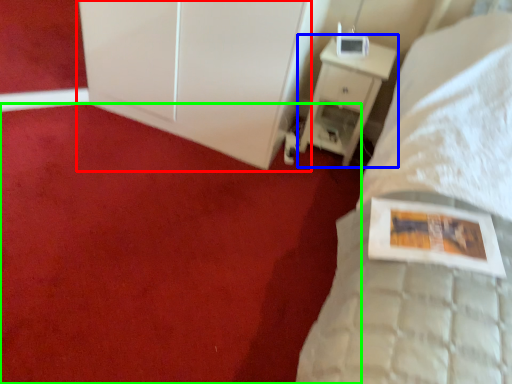
Question: Considering the real-world distances, which object is farthest from dresser (highlighted by a red box)? nightstand (highlighted by a blue box) or plain (highlighted by a green box)?

Choices:
 (A) nightstand
 (B) plain

Answer: (B)